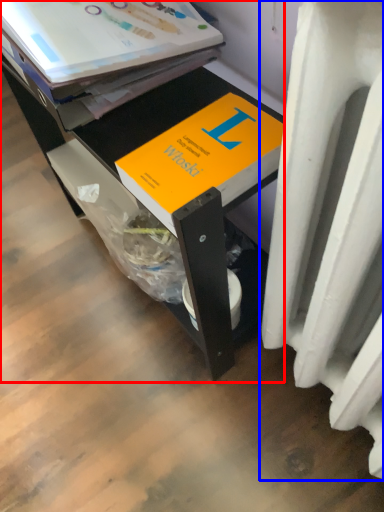
Question: Which point is further to the camera, desk (highlighted by a red box) or heater (highlighted by a blue box)?

Choices:
 (A) desk
 (B) heater

Answer: (A)